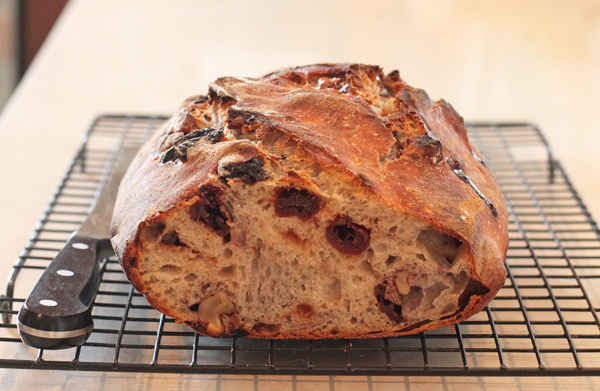
In order to click on cooling rack in this screenshot , I will do pos(467,371).